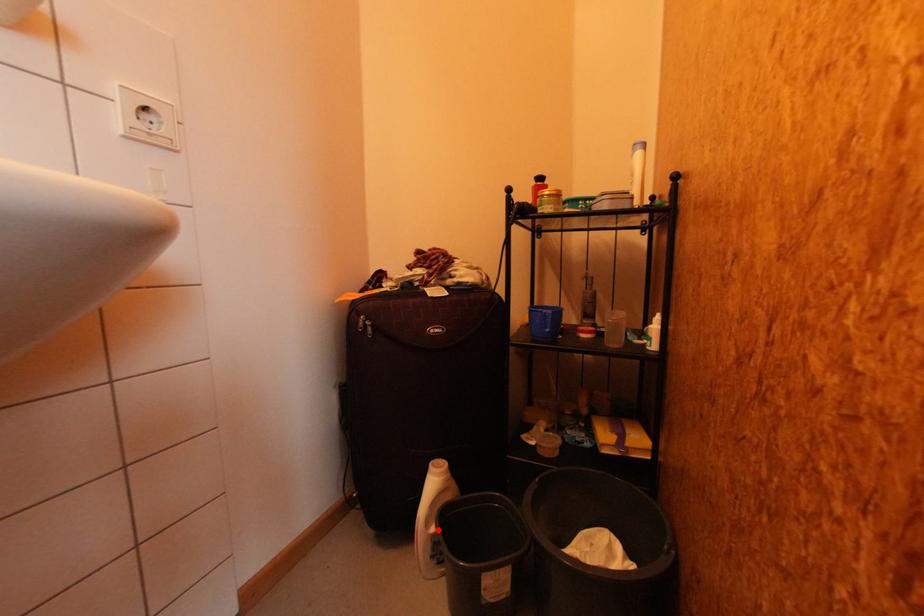
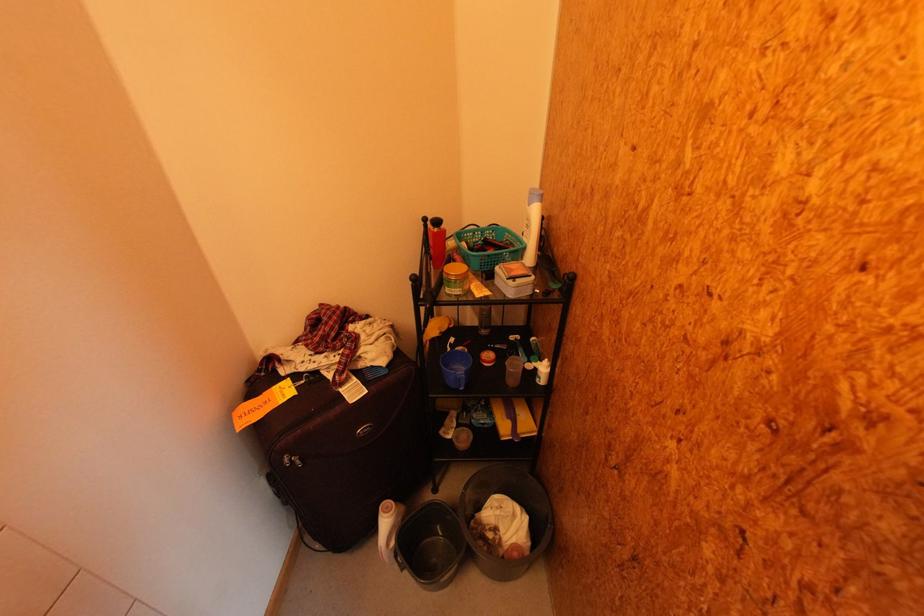
Question: I am providing you with two images of the same scene from different viewpoints. A red point is shown in image1. For the corresponding object point in image2, is it positioned nearer or farther from the camera?

Choices:
 (A) Nearer
 (B) Farther

Answer: (B)